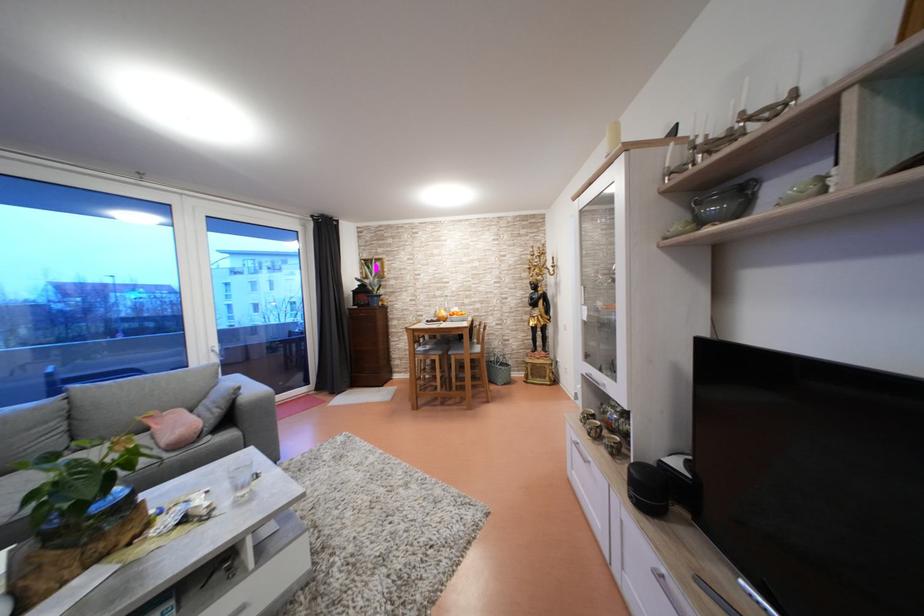
The width and height of the screenshot is (924, 616). Identify the location of white pillar candle. (612, 136).